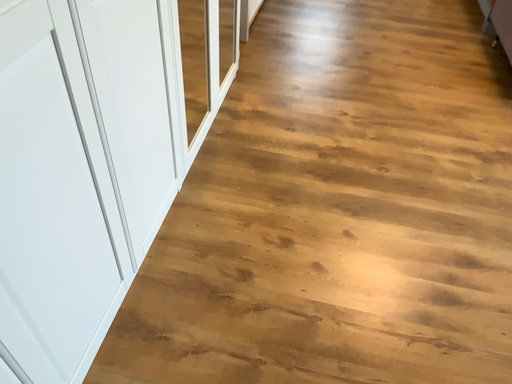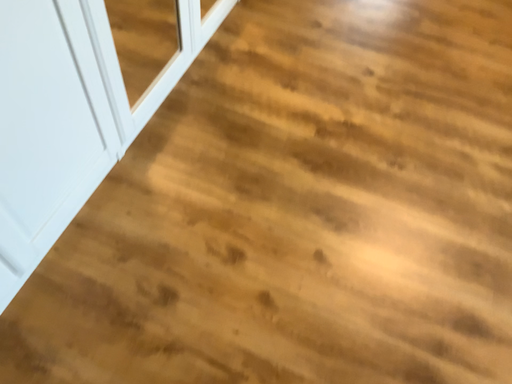
Question: Which way did the camera rotate in the video?

Choices:
 (A) rotated downward
 (B) rotated upward

Answer: (A)